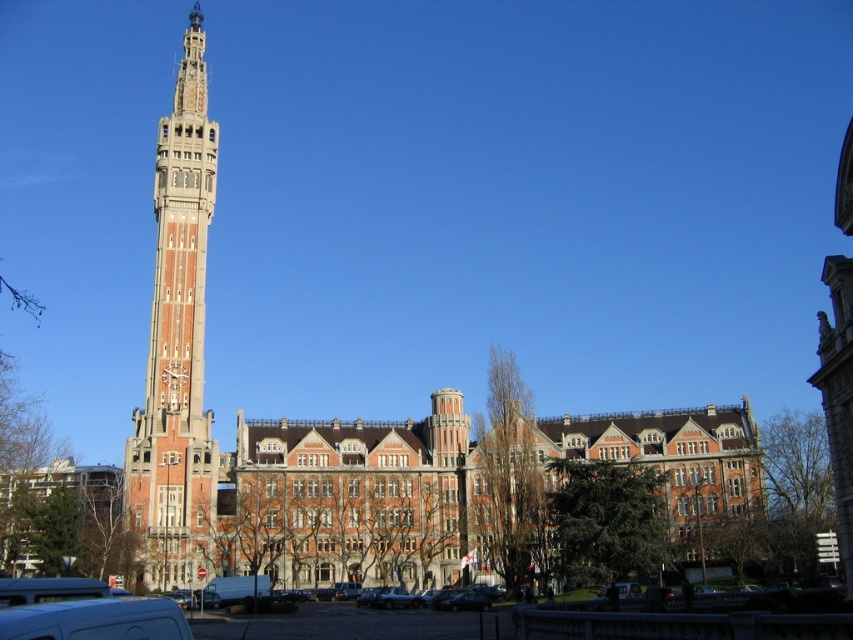
In the scene shown: You are a tour guide explaining the distance between landmarks in the city. You mention the red brick clock tower at left and the white matte van at lower left. How far apart are they?

The red brick clock tower at left is 29.41 meters from the white matte van at lower left.